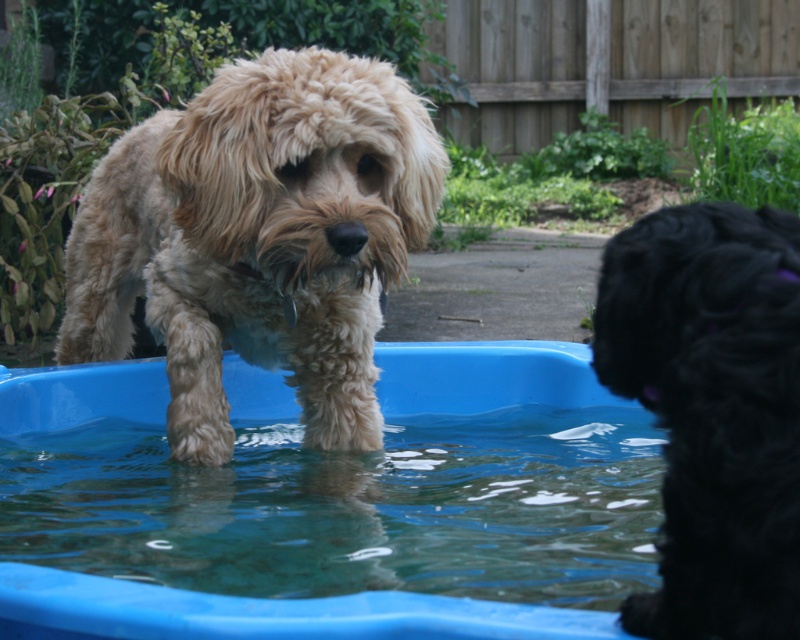
You are standing at the center of the backyard and want to throw a ball to the light brown, fluffy dog in the blue plastic pool. The ball is currently at point A, which is at coordinates point (114, 272). To reach the dog, you need to move the ball to point B at coordinates point (644, 323). Which direction should you move the ball from point A to point B?

You should move the ball upwards and to the right from point A to point B because point (114, 272) is behind point (644, 323), indicating that it is lower and to the left in the image.